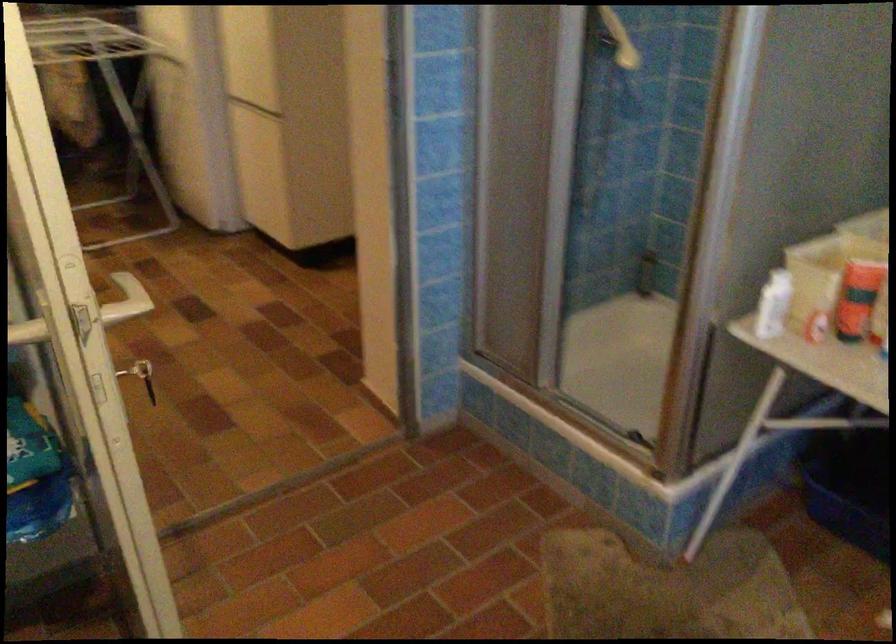
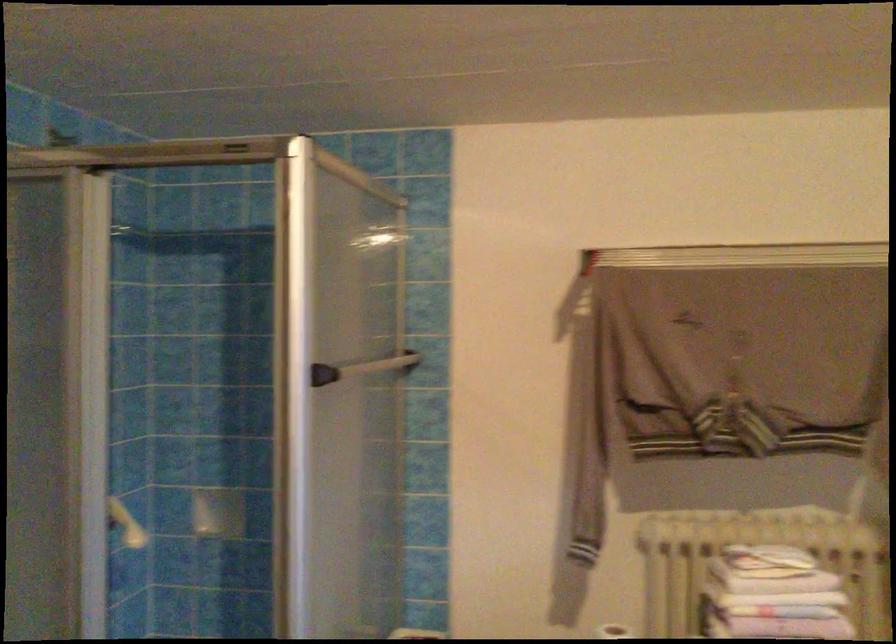
The first image is from the beginning of the video and the second image is from the end. How did the camera likely rotate when shooting the video?

The camera's rotation is toward right-up.